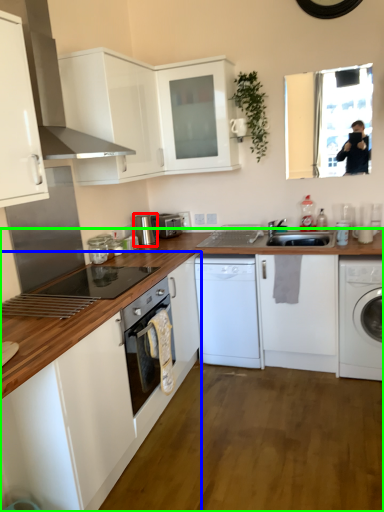
Question: Estimate the real-world distances between objects in this image. Which object is closer to kitchen appliance (highlighted by a red box), cabinetry (highlighted by a blue box) or cabinetry (highlighted by a green box)?

Choices:
 (A) cabinetry
 (B) cabinetry

Answer: (B)